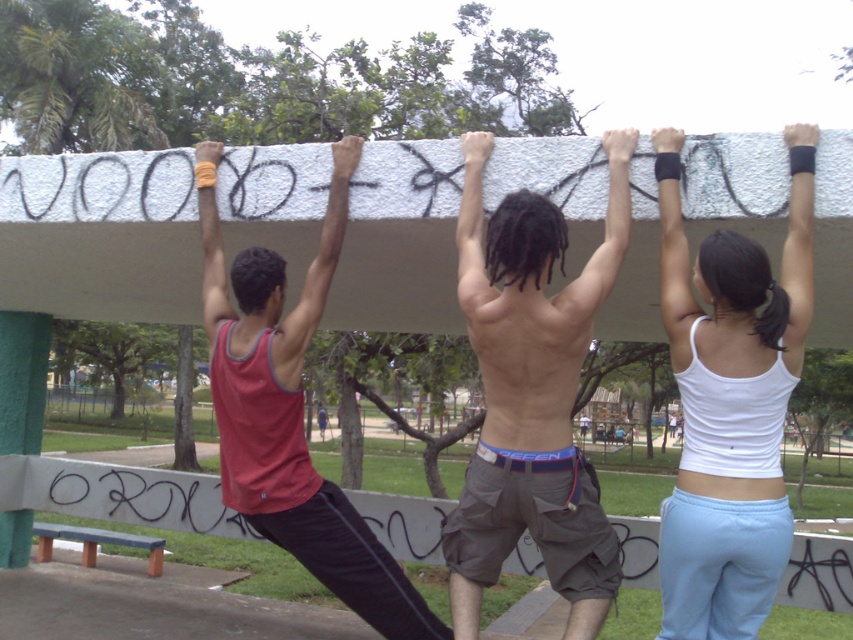
You are a photographer trying to capture the best angle of the scene. You want to ensure both the white fabric tank top at upper center and the shiny metallic shorts at center are visible in the frame. Based on their positions, which object should you focus on first to include both in the shot?

The white fabric tank top at upper center is above the shiny metallic shorts at center, so focusing on the white fabric tank top at upper center first would allow you to adjust the camera angle downward to include both in the frame.

Based on the scene description, which object has a smaller width between the white fabric tank top at upper center and the matte red tank top at center?

The white fabric tank top at upper center has a smaller width compared to the matte red tank top at center.